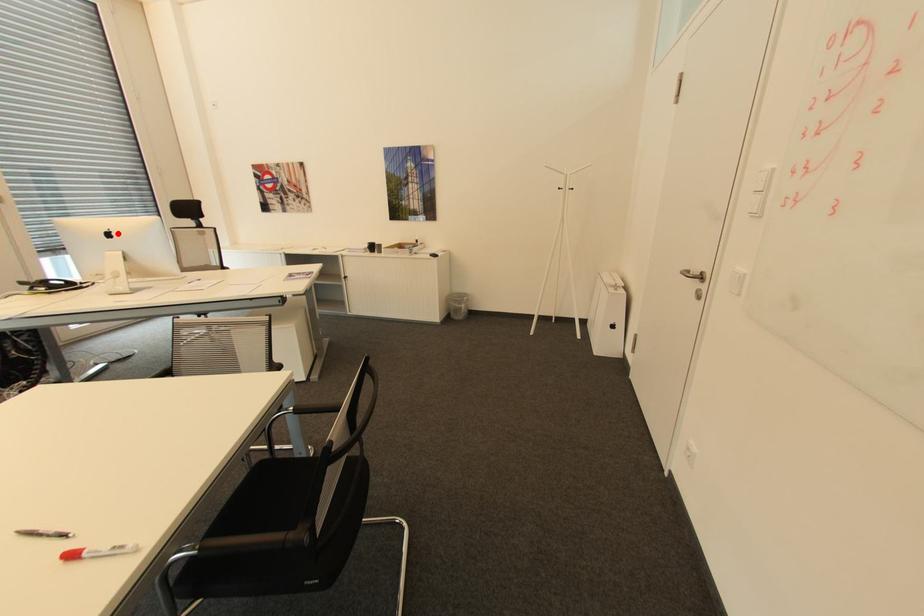
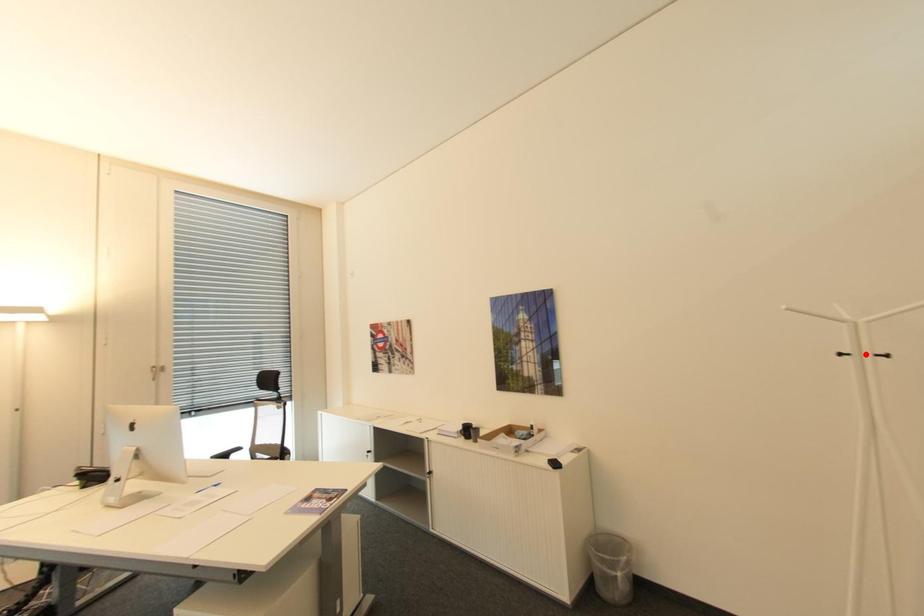
Looking at this image, I am providing you with two images of the same scene from different viewpoints. A red point is marked on the first image and another point is marked on the second image. Are the points marked in image1 and image2 representing the same 3D position?

No